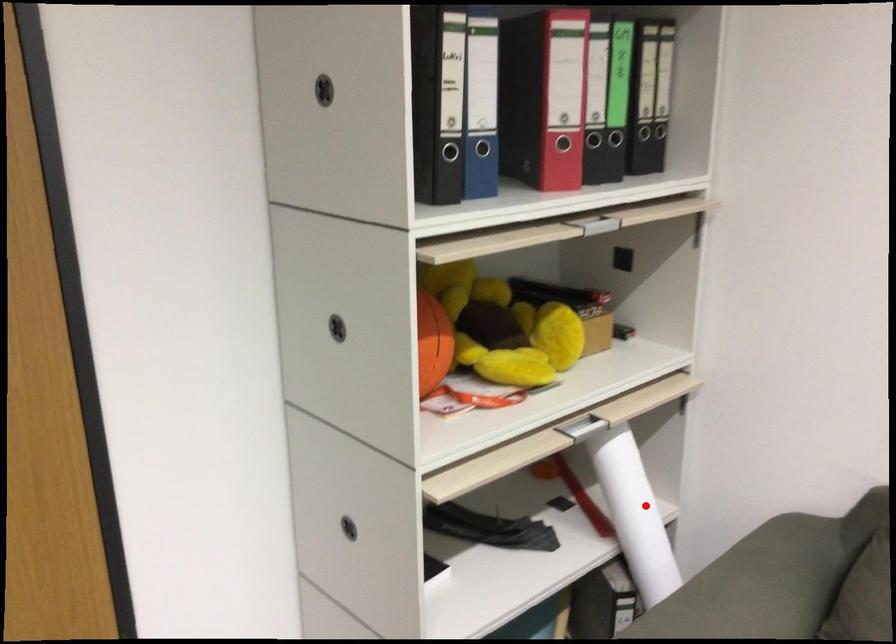
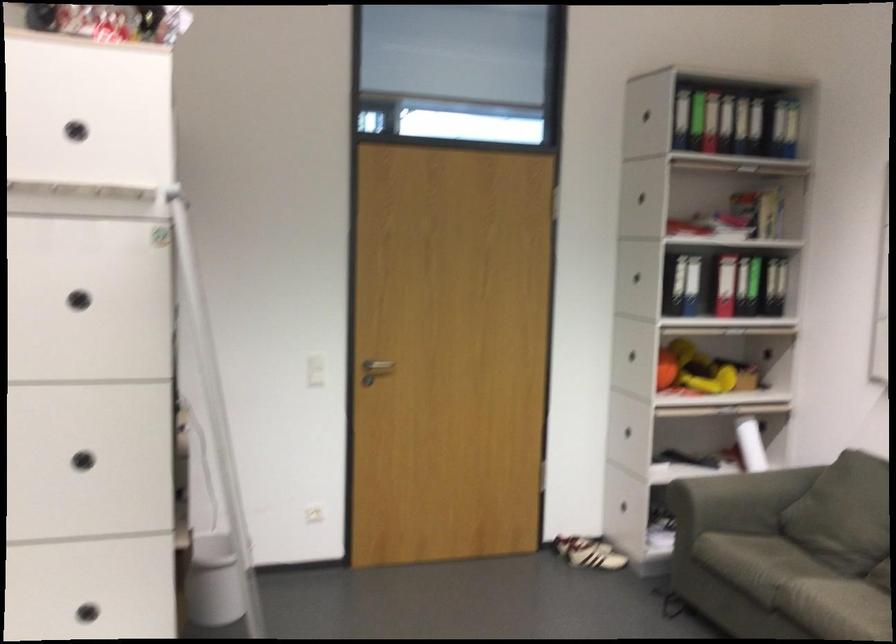
Question: I am providing you with two images of the same scene from different viewpoints. Image1 has a red point marked. In image2, the corresponding 3D location appears at what relative position? Reply with the corresponding letter.

Choices:
 (A) Closer
 (B) Farther

Answer: (B)